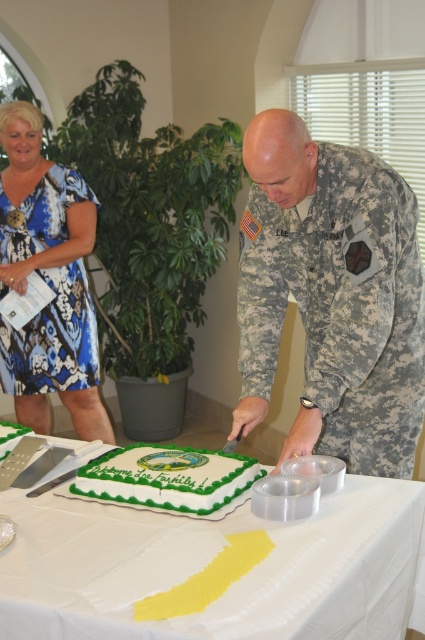
Can you confirm if camouflage fabric uniform at center is positioned to the left of white paper tablecloth at center?

In fact, camouflage fabric uniform at center is to the right of white paper tablecloth at center.

Does camouflage fabric uniform at center have a greater height compared to white paper tablecloth at center?

Indeed, camouflage fabric uniform at center has a greater height compared to white paper tablecloth at center.

Is point (331, 205) more distant than point (422, 616)?

Yes, it is behind point (422, 616).

Find the location of a particular element. This screenshot has width=425, height=640. camouflage fabric uniform at center is located at coordinates (342, 307).

Does camouflage uniform at center have a larger size compared to green frosted cake at center?

Indeed, camouflage uniform at center has a larger size compared to green frosted cake at center.

Which is in front, point (379, 323) or point (248, 483)?

Positioned in front is point (248, 483).

You are a GUI agent. You are given a task and a screenshot of the screen. Output one action in this format:
    pyautogui.click(x=<x>, y=<y>)
    Task: Click on the camouflage uniform at center
    This screenshot has width=425, height=640.
    Given the screenshot: What is the action you would take?
    pyautogui.click(x=331, y=296)

Is camouflage uniform at center smaller than camouflage fabric uniform at center?

No.

The height and width of the screenshot is (640, 425). Describe the element at coordinates (331, 296) in the screenshot. I see `camouflage uniform at center` at that location.

Which is behind, point (317, 166) or point (362, 330)?

Point (317, 166)

Locate an element on the screen. camouflage uniform at center is located at coordinates (331, 296).